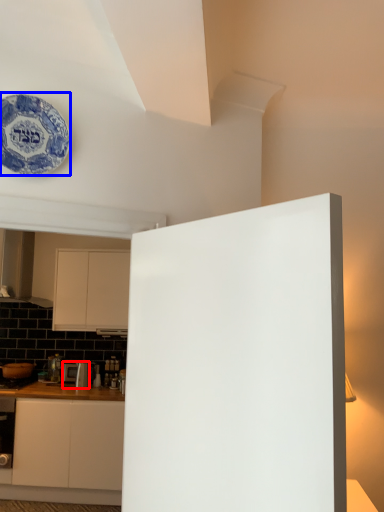
Question: Among these objects, which one is nearest to the camera, appliance (highlighted by a red box) or plate (highlighted by a blue box)?

Choices:
 (A) appliance
 (B) plate

Answer: (B)